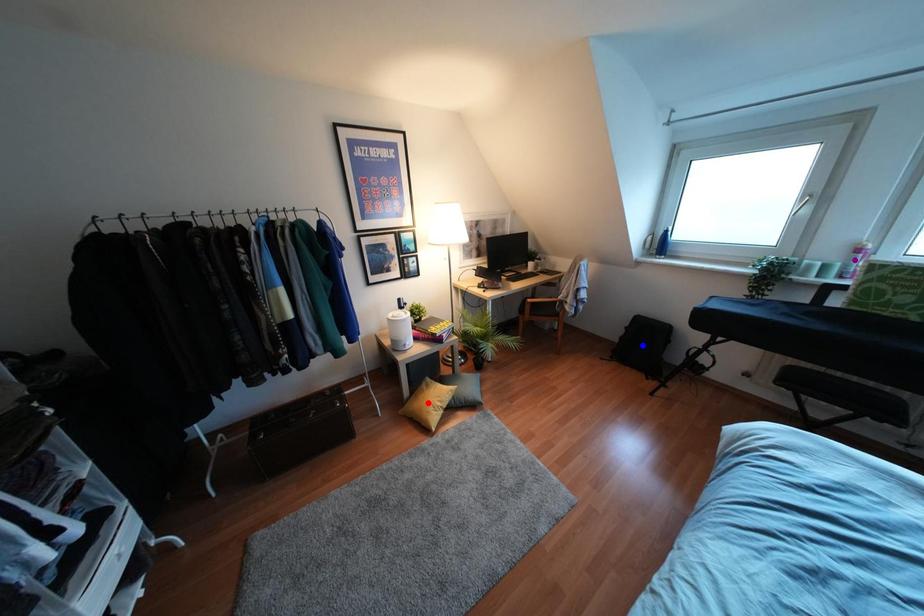
Order these from nearest to farthest:
- red point
- blue point
- purple point

blue point → red point → purple point